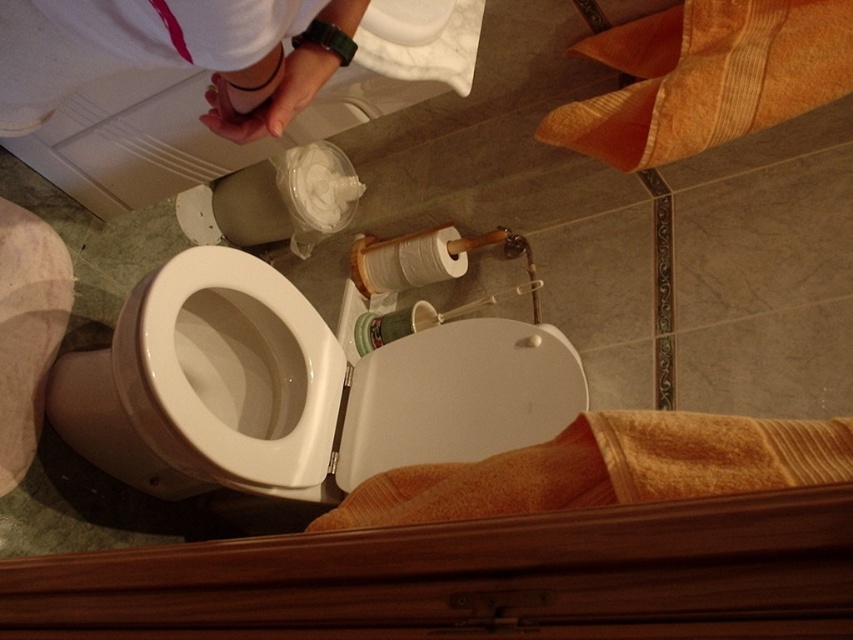
Question: In this image, where is white matte toilet paper at center located relative to green plastic cup at center?

Choices:
 (A) below
 (B) above

Answer: (B)

Question: Can you confirm if white matte toilet paper at center is smaller than green plastic cup at center?

Choices:
 (A) yes
 (B) no

Answer: (B)

Question: Can you confirm if white fabric at upper left is thinner than green plastic cup at center?

Choices:
 (A) no
 (B) yes

Answer: (A)

Question: Which point is farther from the camera taking this photo?

Choices:
 (A) (397, 317)
 (B) (149, 307)
 (C) (387, 253)
 (D) (292, 33)

Answer: (C)

Question: Among these objects, which one is nearest to the camera?

Choices:
 (A) white matte toilet paper at center
 (B) white fabric at upper left
 (C) white glossy toilet lid at center

Answer: (B)

Question: Among these objects, which one is farthest from the camera?

Choices:
 (A) white glossy toilet lid at center
 (B) white glossy toilet bowl at center
 (C) green plastic cup at center
 (D) white matte toilet paper at center

Answer: (D)